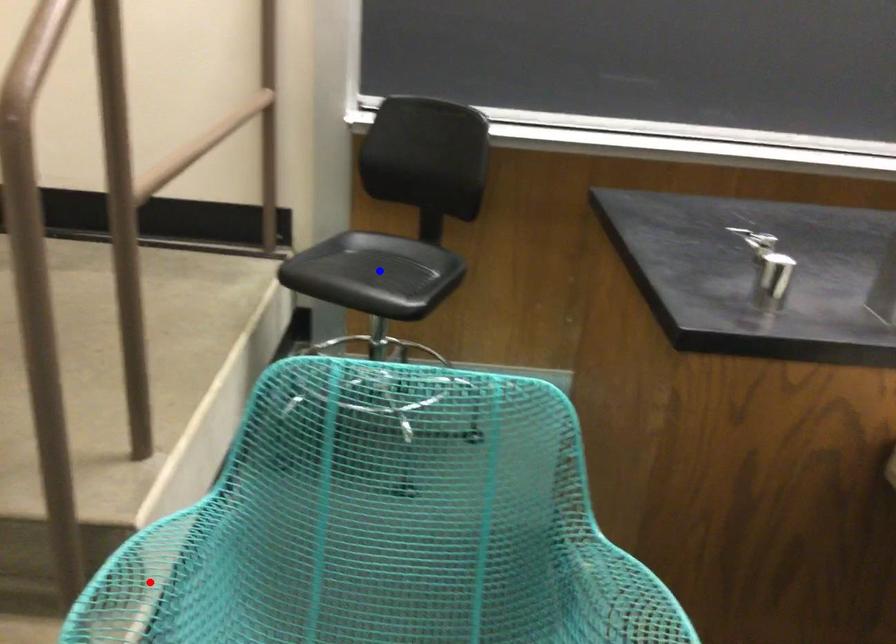
Question: In the image, two points are highlighted. Which point is nearer to the camera? Reply with the corresponding letter.

Choices:
 (A) blue point
 (B) red point

Answer: (B)